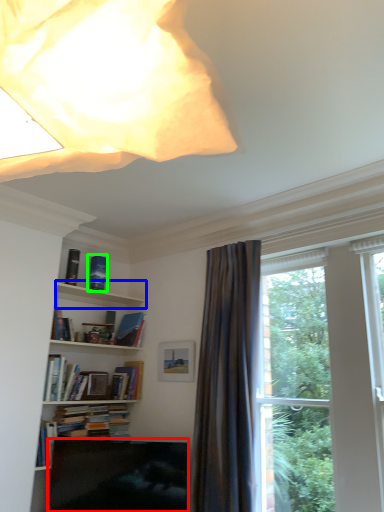
Question: Estimate the real-world distances between objects in this image. Which object is closer to furniture (highlighted by a red box), cabinet (highlighted by a blue box) or book (highlighted by a green box)?

Choices:
 (A) cabinet
 (B) book

Answer: (A)